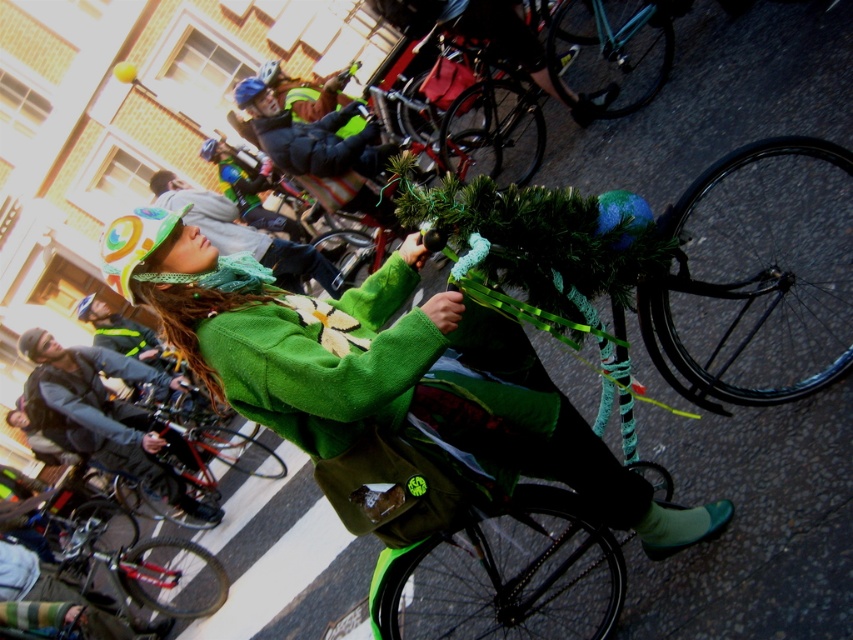
Question: Which object is farther from the camera taking this photo?

Choices:
 (A) green fuzzy hat at center
 (B) green knitted hat at upper left

Answer: (A)

Question: Which of the following is the closest to the observer?

Choices:
 (A) (392, 458)
 (B) (148, 483)

Answer: (A)

Question: Is green knitted hat at upper left bigger than green fuzzy hat at center?

Choices:
 (A) yes
 (B) no

Answer: (B)

Question: Estimate the real-world distances between objects in this image. Which object is closer to the green knitted hat at upper left?

Choices:
 (A) green fuzzy hat at center
 (B) green woolen coat at center

Answer: (A)

Question: Is green knitted hat at upper left behind green woolen coat at center?

Choices:
 (A) no
 (B) yes

Answer: (A)

Question: Does green knitted hat at upper left appear under green woolen coat at center?

Choices:
 (A) yes
 (B) no

Answer: (B)